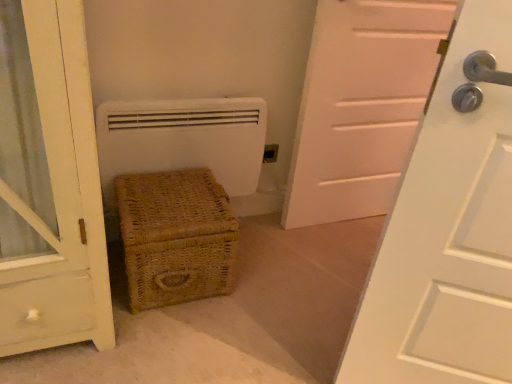
I want to click on free spot below white matte door at center (from a real-world perspective), so click(x=344, y=217).